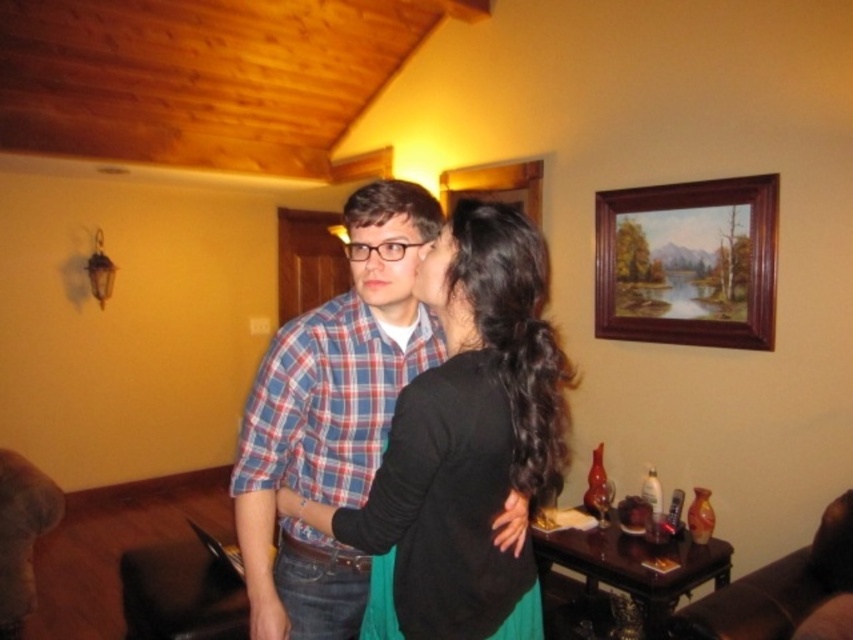
Which is above, plaid cotton shirt at center or wooden picture frame at upper right?

wooden picture frame at upper right

Can you confirm if plaid cotton shirt at center is positioned above wooden picture frame at upper right?

No.

Measure the distance between point (x=350, y=332) and camera.

5.12 feet

Find the location of a particular element. This screenshot has width=853, height=640. plaid cotton shirt at center is located at coordinates (332, 416).